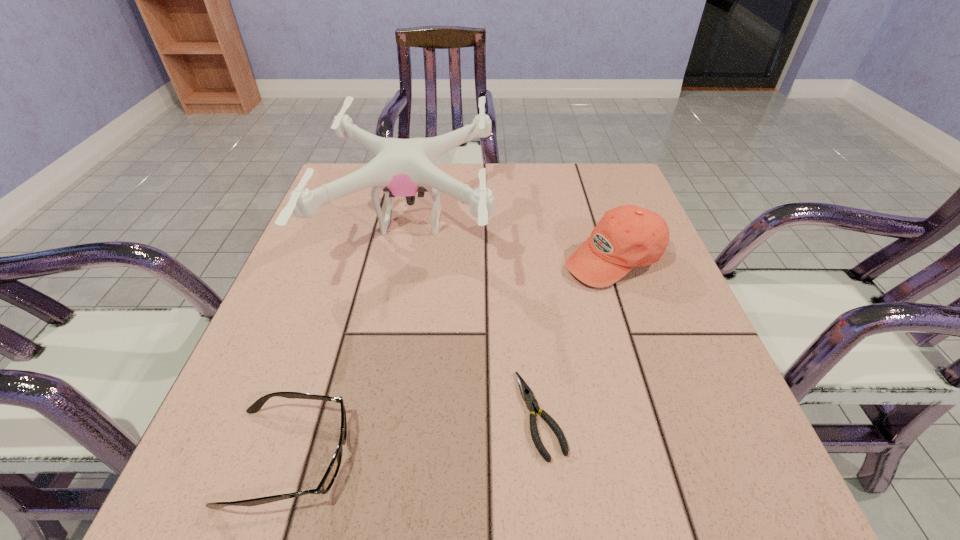
Locate an element on the screen. vacant space at the left edge is located at coordinates (329, 211).

The width and height of the screenshot is (960, 540). I want to click on blank space at the right edge of the desktop, so click(x=671, y=380).

Find the location of a particular element. vacant space at the far left corner of the desktop is located at coordinates (337, 204).

Find the location of a particular element. vacant position at the far right corner of the desktop is located at coordinates (595, 187).

In order to click on empty space that is in between the tallest object and the second shortest object in this screenshot , I will do `click(350, 339)`.

Where is `empty space between the drone and the pliers`? This screenshot has height=540, width=960. empty space between the drone and the pliers is located at coordinates (476, 318).

Identify the location of vacant space in between the drone and the third object from left to right. (476, 318).

Locate an element on the screen. Image resolution: width=960 pixels, height=540 pixels. free point between the second tallest object and the spectacles is located at coordinates (451, 358).

I want to click on free area in between the second object from right to left and the third shortest object, so click(577, 337).

You are a GUI agent. You are given a task and a screenshot of the screen. Output one action in this format:
    pyautogui.click(x=<x>, y=<y>)
    Task: Click on the vacant space in between the second tallest object and the third tallest object
    This screenshot has width=960, height=540.
    Given the screenshot: What is the action you would take?
    pyautogui.click(x=451, y=358)